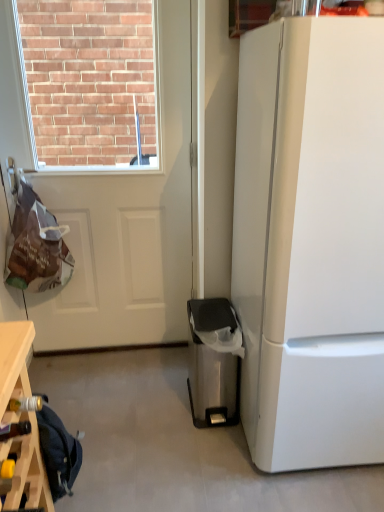
Locate an element on the screen. free space to the left of white glossy refrigerator at right is located at coordinates (169, 438).